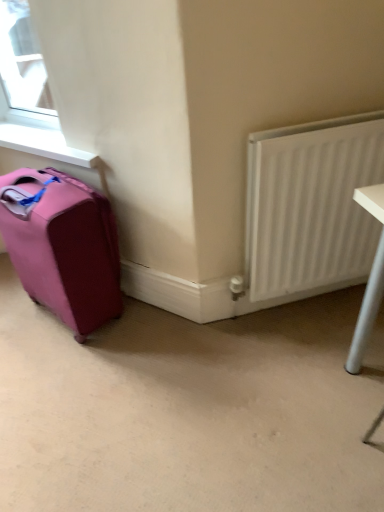
Question: Is pink fabric suitcase at left further to the viewer compared to beige carpet at lower center?

Choices:
 (A) no
 (B) yes

Answer: (B)

Question: Would you say pink fabric suitcase at left is outside beige carpet at lower center?

Choices:
 (A) yes
 (B) no

Answer: (A)

Question: From a real-world perspective, does pink fabric suitcase at left sit lower than beige carpet at lower center?

Choices:
 (A) yes
 (B) no

Answer: (B)

Question: Would you say pink fabric suitcase at left contains beige carpet at lower center?

Choices:
 (A) yes
 (B) no

Answer: (B)

Question: Can you confirm if pink fabric suitcase at left is shorter than beige carpet at lower center?

Choices:
 (A) yes
 (B) no

Answer: (B)

Question: Considering the relative positions of pink fabric suitcase at left and beige carpet at lower center in the image provided, is pink fabric suitcase at left to the left of beige carpet at lower center from the viewer's perspective?

Choices:
 (A) yes
 (B) no

Answer: (A)

Question: Does pink fabric suitcase at left have a lesser width compared to white smooth window sill at upper left?

Choices:
 (A) no
 (B) yes

Answer: (A)

Question: Is pink fabric suitcase at left positioned behind white smooth window sill at upper left?

Choices:
 (A) yes
 (B) no

Answer: (B)

Question: Considering the relative sizes of pink fabric suitcase at left and white smooth window sill at upper left in the image provided, is pink fabric suitcase at left wider than white smooth window sill at upper left?

Choices:
 (A) yes
 (B) no

Answer: (A)

Question: Does pink fabric suitcase at left have a lesser height compared to white smooth window sill at upper left?

Choices:
 (A) no
 (B) yes

Answer: (A)

Question: Is there a large distance between pink fabric suitcase at left and white smooth window sill at upper left?

Choices:
 (A) yes
 (B) no

Answer: (B)

Question: Is pink fabric suitcase at left facing away from white smooth window sill at upper left?

Choices:
 (A) yes
 (B) no

Answer: (B)

Question: From a real-world perspective, is white smooth window sill at upper left located beneath pink fabric suitcase at left?

Choices:
 (A) no
 (B) yes

Answer: (A)